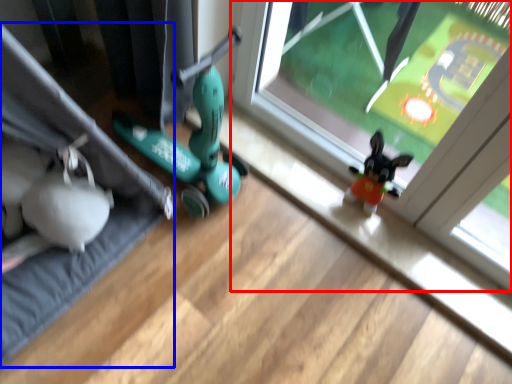
Question: Which object appears closest to the camera in this image, window (highlighted by a red box) or yoga mat (highlighted by a blue box)?

Choices:
 (A) window
 (B) yoga mat

Answer: (B)